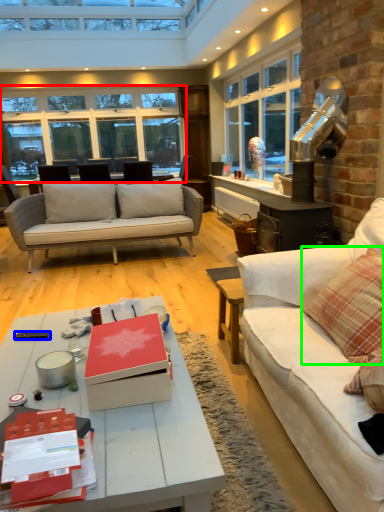
Question: Based on their relative distances, which object is nearer to window (highlighted by a red box)? Choose from remote control (highlighted by a blue box) and pillow (highlighted by a green box).

Choices:
 (A) remote control
 (B) pillow

Answer: (A)